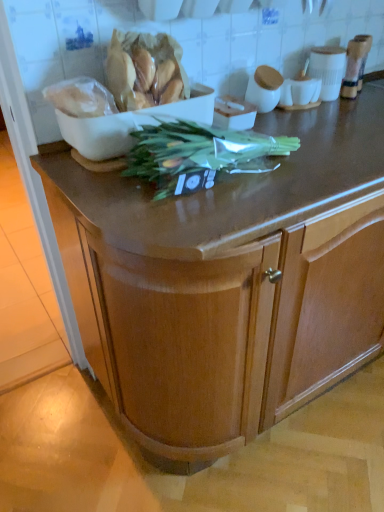
This screenshot has height=512, width=384. What are the coordinates of `free point in front of green leafy vegetable at center` in the screenshot? It's located at (210, 211).